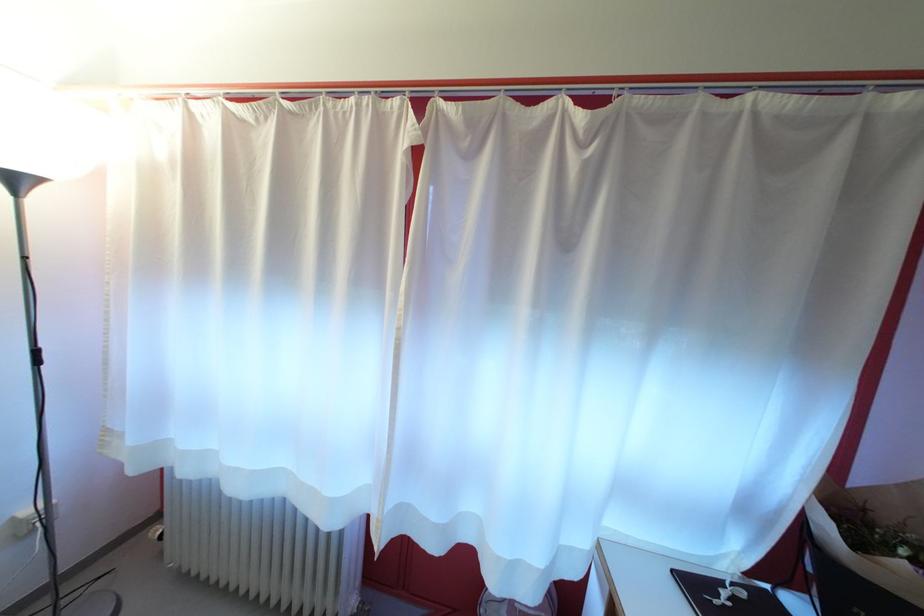
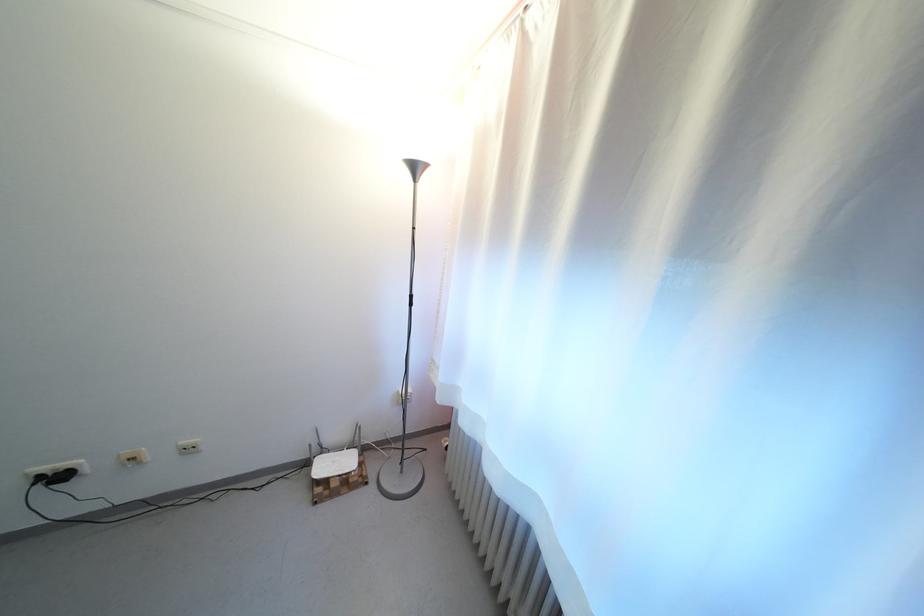
Question: The camera is either moving clockwise (left) or counter-clockwise (right) around the object. The first image is from the beginning of the video and the second image is from the end. Is the camera moving left or right when shooting the video?

Choices:
 (A) Left
 (B) Right

Answer: (B)